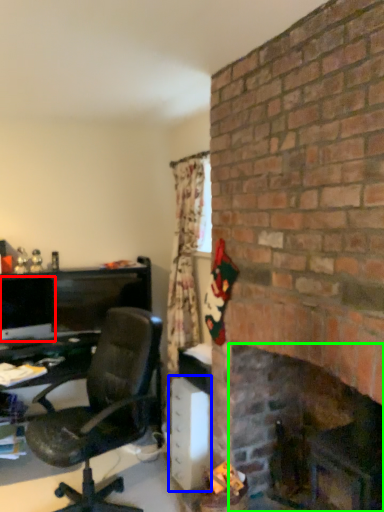
Question: Which object is positioned closest to computer monitor (highlighted by a red box)? Select from file cabinet (highlighted by a blue box) and fireplace (highlighted by a green box).

Choices:
 (A) file cabinet
 (B) fireplace

Answer: (A)